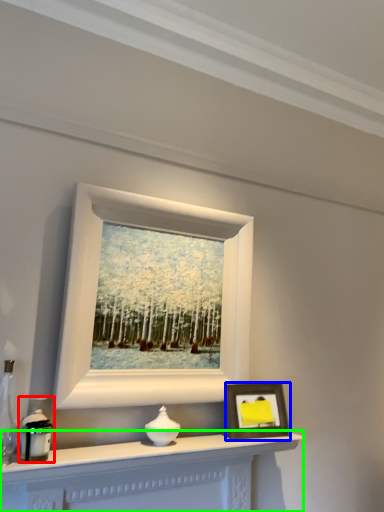
Question: Which object is the closest to the candle holder (highlighted by a red box)? Choose among these: picture frame (highlighted by a blue box) or table (highlighted by a green box).

Choices:
 (A) picture frame
 (B) table

Answer: (B)